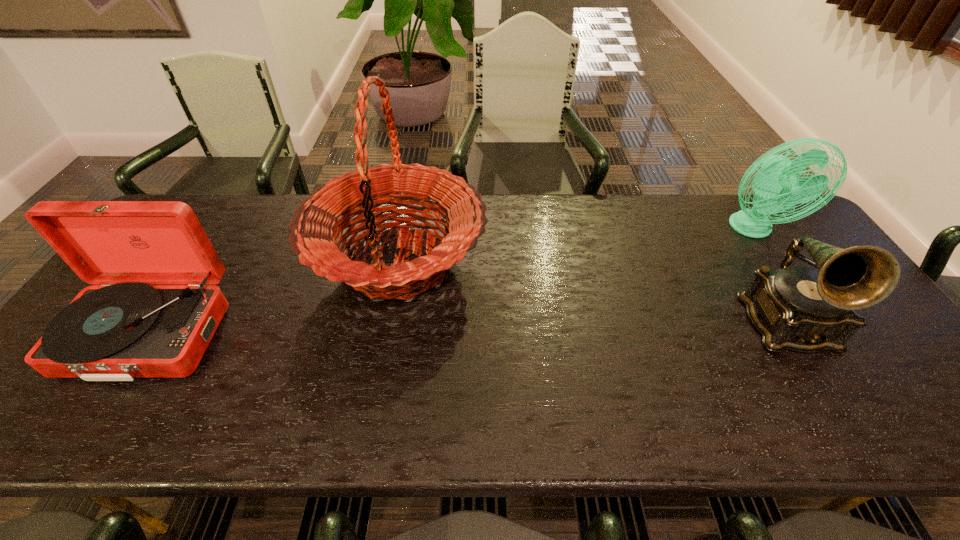
This screenshot has width=960, height=540. I want to click on unoccupied position between the left phonograph_record and the fan, so click(x=450, y=282).

Where is `vacant region between the right phonograph_record and the tallest object`? vacant region between the right phonograph_record and the tallest object is located at coordinates (592, 293).

I want to click on vacant area between the fan and the tallest object, so click(x=575, y=246).

The image size is (960, 540). I want to click on free space between the right phonograph_record and the second object from left to right, so 592,293.

The image size is (960, 540). I want to click on unoccupied position between the left phonograph_record and the right phonograph_record, so click(467, 329).

Identify the location of free space between the basket and the right phonograph_record. click(x=592, y=293).

Locate an element on the screen. This screenshot has height=540, width=960. free space between the tallest object and the left phonograph_record is located at coordinates coord(274,298).

Identify which object is the second closest to the right phonograph_record. Please provide its 2D coordinates. Your answer should be formatted as a tuple, i.e. [(x, y)], where the tuple contains the x and y coordinates of a point satisfying the conditions above.

[(315, 228)]

Point out which object is positioned as the third nearest to the right phonograph_record. Please provide its 2D coordinates. Your answer should be formatted as a tuple, i.e. [(x, y)], where the tuple contains the x and y coordinates of a point satisfying the conditions above.

[(124, 329)]